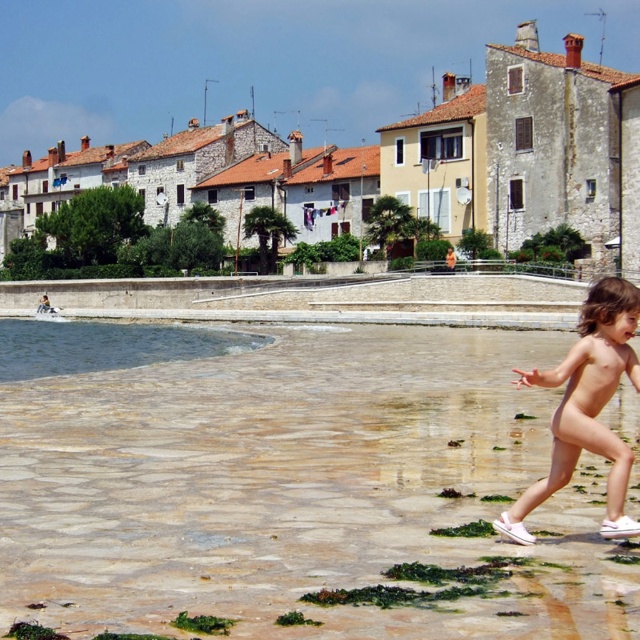
Question: Estimate the real-world distances between objects in this image. Which object is closer to the clear stone water at lower left?

Choices:
 (A) clear water at lower left
 (B) smooth skin child at lower right

Answer: (B)

Question: Can you confirm if smooth skin child at lower right is wider than clear water at lower left?

Choices:
 (A) no
 (B) yes

Answer: (A)

Question: Which object is the closest to the clear water at lower left?

Choices:
 (A) smooth skin child at lower right
 (B) clear stone water at lower left

Answer: (B)

Question: Which point is closer to the camera?

Choices:
 (A) clear stone water at lower left
 (B) smooth skin child at lower right

Answer: (A)

Question: Can you confirm if clear stone water at lower left is positioned below smooth skin child at lower right?

Choices:
 (A) yes
 (B) no

Answer: (A)

Question: Does clear stone water at lower left have a lesser width compared to clear water at lower left?

Choices:
 (A) yes
 (B) no

Answer: (B)